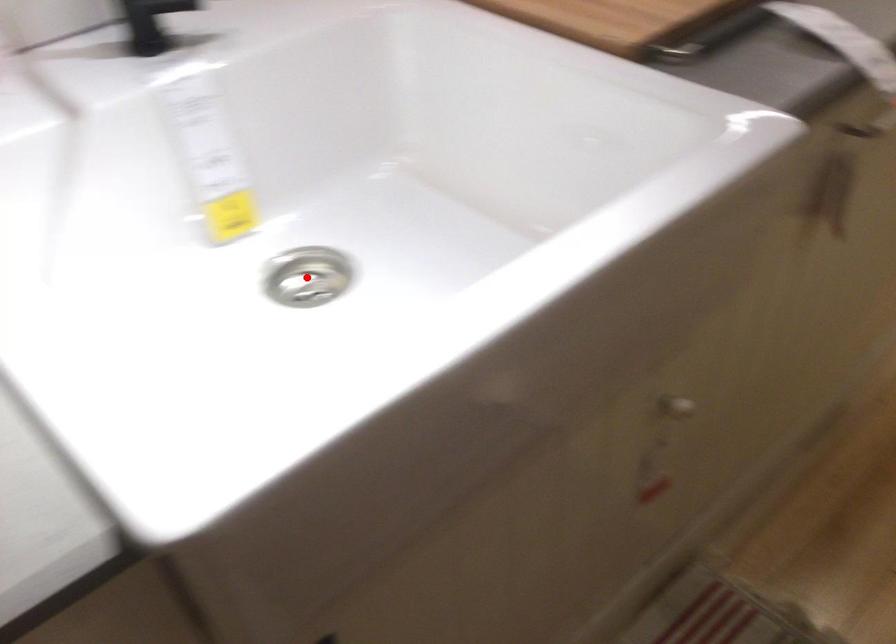
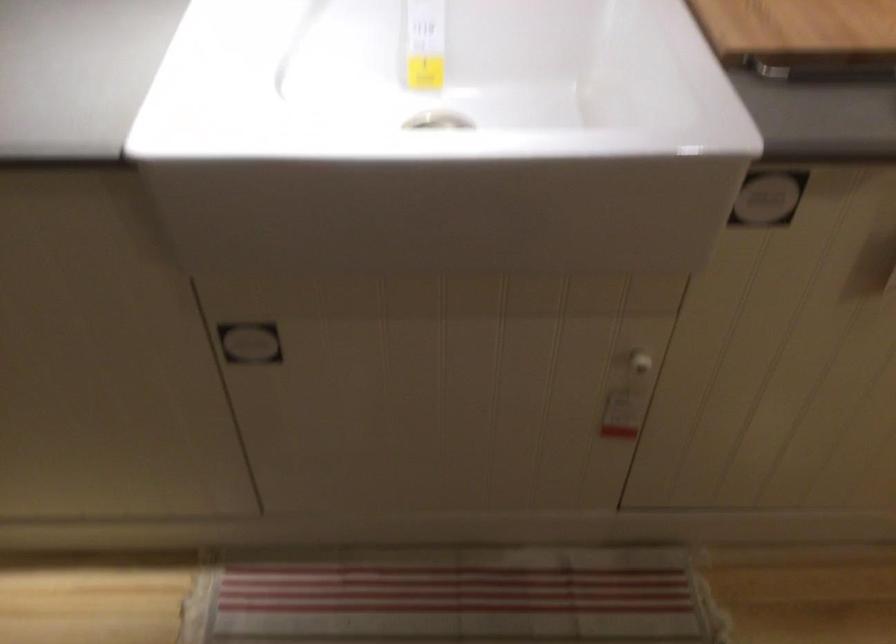
Question: I am providing you with two images of the same scene from different viewpoints. A red point is marked on the first image. Is the red point's position out of view in image 2?

Choices:
 (A) Yes
 (B) No

Answer: (A)